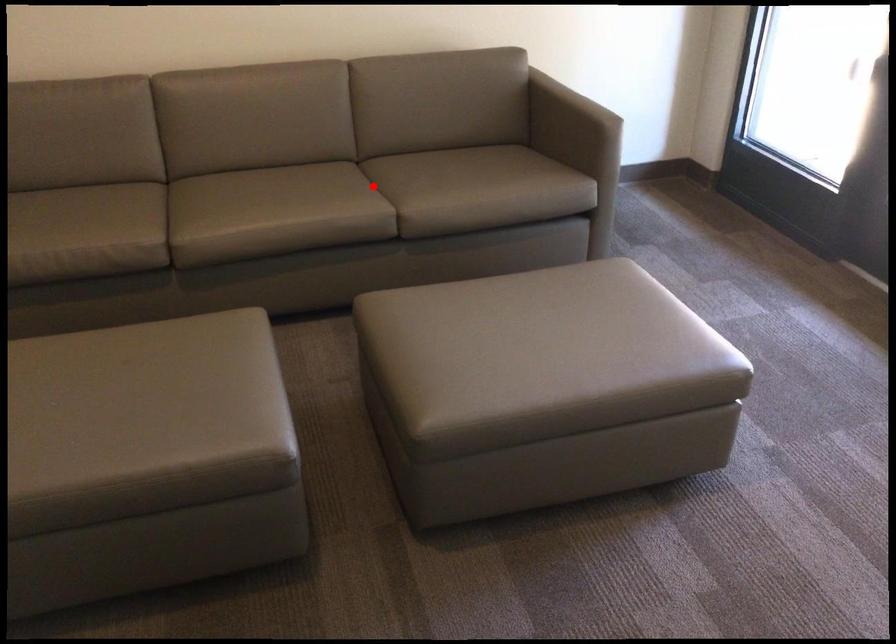
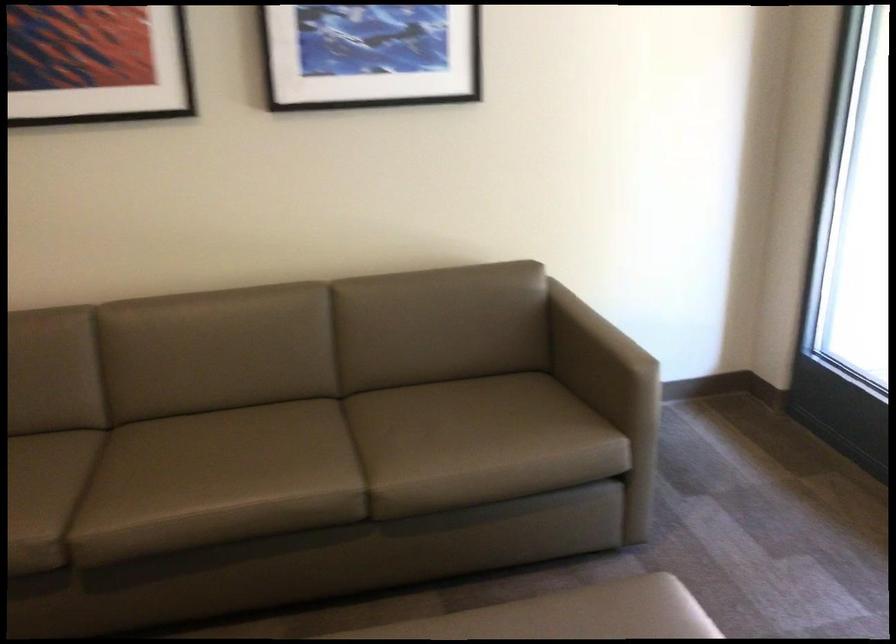
Locate, in the second image, the point that corresponds to the highlighted location in the first image.

(356, 450)